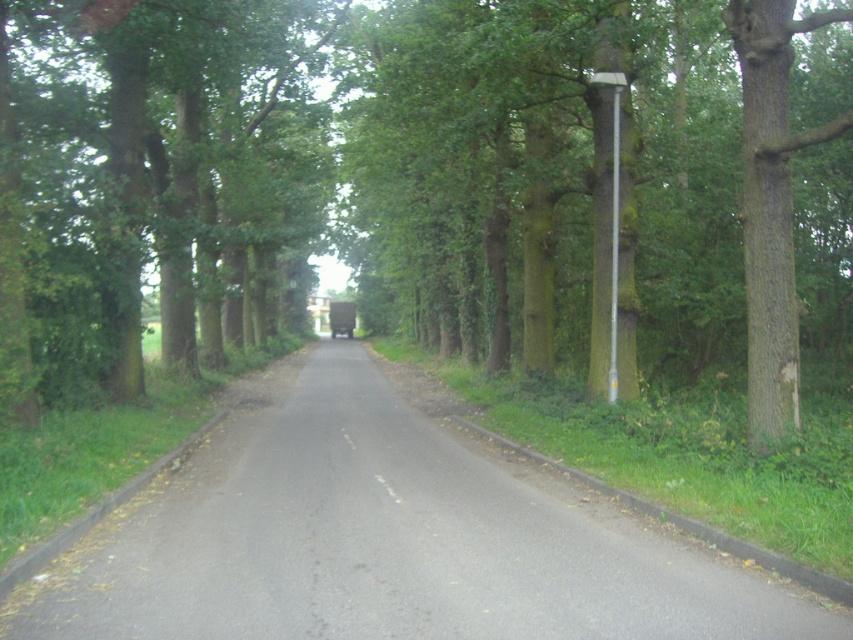
You are driving a car that is 4 meters long. You want to park your car between the green leafy tree at center and the asphalt road at center. Is there enough space between them to park your car?

The distance between the green leafy tree at center and the asphalt road at center is 8.34 meters. Since your car is only 4 meters long, there is sufficient space to park between them.

You are standing at the point marked as point [303,163] on the image. Based on the scene description, what object or feature is located exactly at this coordinate?

The point [303,163] corresponds to the green leafy tree at center.

You are standing on the narrow road and want to walk towards the lamppost on the right side. There are two points marked on the road surface. Which point, point 1 at coordinates (592, 273) or point 2 at coordinates (299, 598), is closer to your current position when you start walking towards the lamppost?

Point 2 at coordinates (299, 598) is closer to your current position because it is nearer to the camera compared to point 1 at coordinates (592, 273), which is further away.